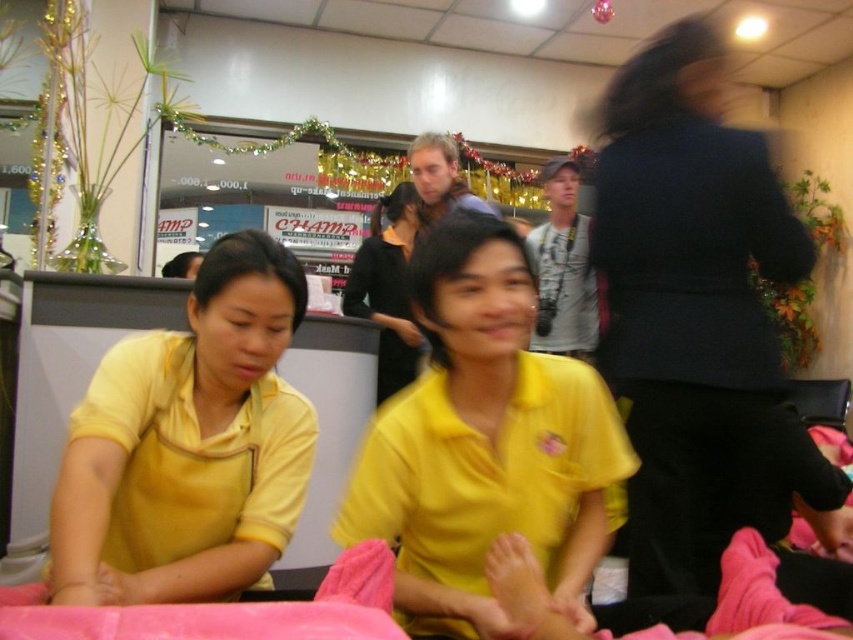
Is black matte jacket at upper right above matte black shirt at center?

No, black matte jacket at upper right is not above matte black shirt at center.

Is black matte jacket at upper right positioned in front of matte black shirt at center?

Yes, black matte jacket at upper right is in front of matte black shirt at center.

Between point (689, 330) and point (381, 304), which one is positioned behind?

The point (381, 304) is behind.

This screenshot has height=640, width=853. Identify the location of black matte jacket at upper right. (703, 330).

The height and width of the screenshot is (640, 853). Describe the element at coordinates (703, 330) in the screenshot. I see `black matte jacket at upper right` at that location.

Is point (724, 490) behind point (544, 554)?

That is True.

Where is `black matte jacket at upper right`? Image resolution: width=853 pixels, height=640 pixels. black matte jacket at upper right is located at coordinates (703, 330).

Is yellow matte shirt at left to the right of matte black shirt at center from the viewer's perspective?

In fact, yellow matte shirt at left is to the left of matte black shirt at center.

Between point (93, 520) and point (412, 225), which one is positioned in front?

Point (93, 520)

Is point (137, 588) in front of point (386, 209)?

Yes.

The width and height of the screenshot is (853, 640). What are the coordinates of `yellow matte shirt at left` in the screenshot? It's located at (189, 444).